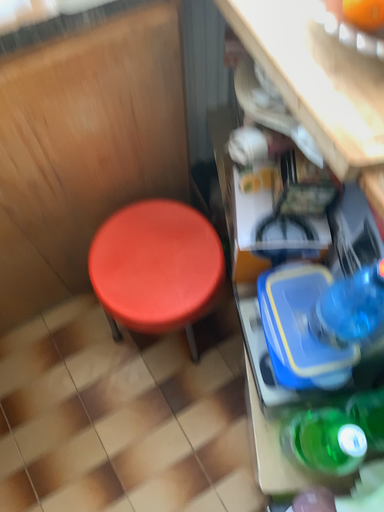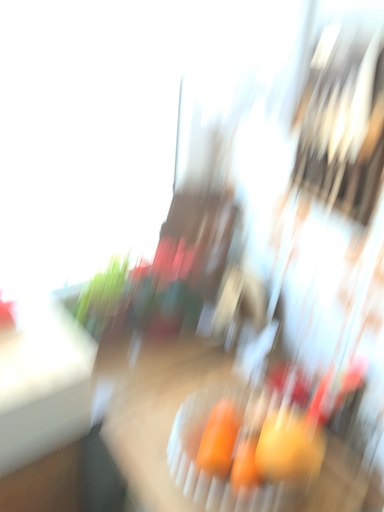
Question: How did the camera likely rotate when shooting the video?

Choices:
 (A) rotated right
 (B) rotated left

Answer: (A)